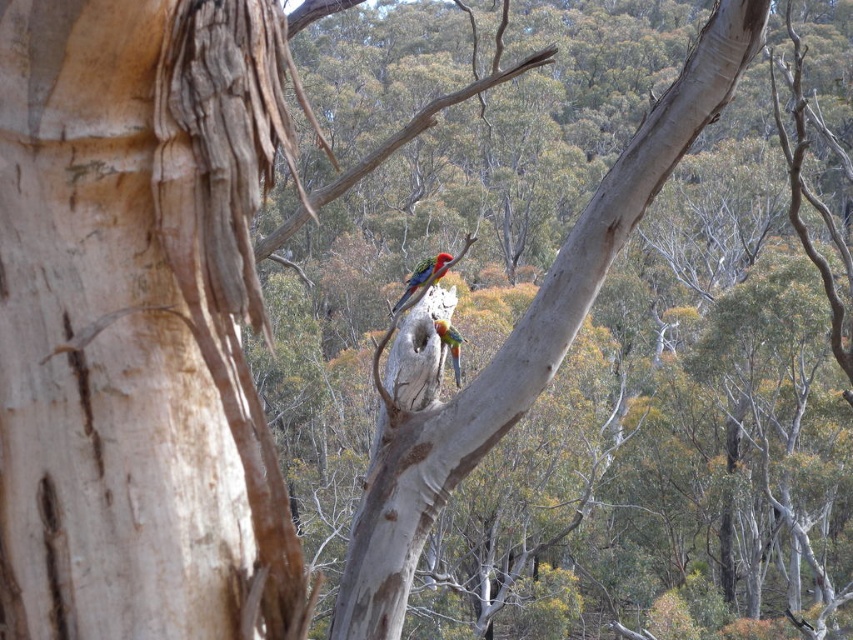
Is smooth white bark at left bigger than smooth bark tree at center?

No, smooth white bark at left is not bigger than smooth bark tree at center.

Which of these two, smooth white bark at left or smooth bark tree at center, stands shorter?

With less height is smooth white bark at left.

Who is more forward, (x=99, y=99) or (x=444, y=412)?

Point (x=99, y=99) is in front.

This screenshot has width=853, height=640. Find the location of `smooth white bark at left`. smooth white bark at left is located at coordinates tap(138, 321).

Measure the distance from smooth bark tree at center to multicolored glossy parrot at center.

The distance of smooth bark tree at center from multicolored glossy parrot at center is 4.83 feet.

Is smooth bark tree at center below multicolored glossy parrot at center?

No, smooth bark tree at center is not below multicolored glossy parrot at center.

Locate an element on the screen. smooth bark tree at center is located at coordinates (515, 340).

Is shiny multicolored parrot at center taller than multicolored glossy parrot at center?

Correct, shiny multicolored parrot at center is much taller as multicolored glossy parrot at center.

Image resolution: width=853 pixels, height=640 pixels. What do you see at coordinates (422, 275) in the screenshot? I see `shiny multicolored parrot at center` at bounding box center [422, 275].

The height and width of the screenshot is (640, 853). In order to click on shiny multicolored parrot at center in this screenshot , I will do `click(422, 275)`.